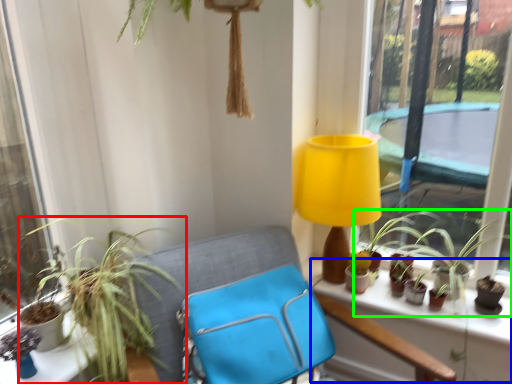
Question: Estimate the real-world distances between objects in this image. Which object is farther from houseplant (highlighted by a red box), window sill (highlighted by a blue box) or houseplant (highlighted by a green box)?

Choices:
 (A) window sill
 (B) houseplant

Answer: (B)